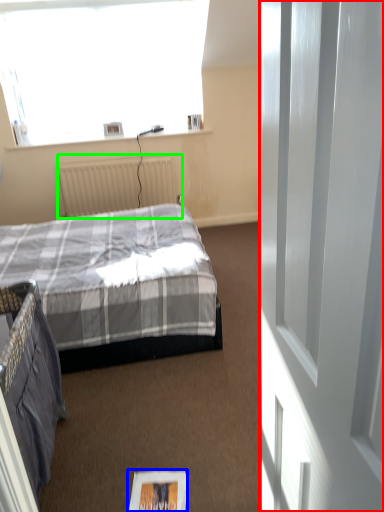
Question: Which object is positioned farthest from screen door (highlighted by a red box)? Select from magazine (highlighted by a blue box) and radiator (highlighted by a green box).

Choices:
 (A) magazine
 (B) radiator

Answer: (B)